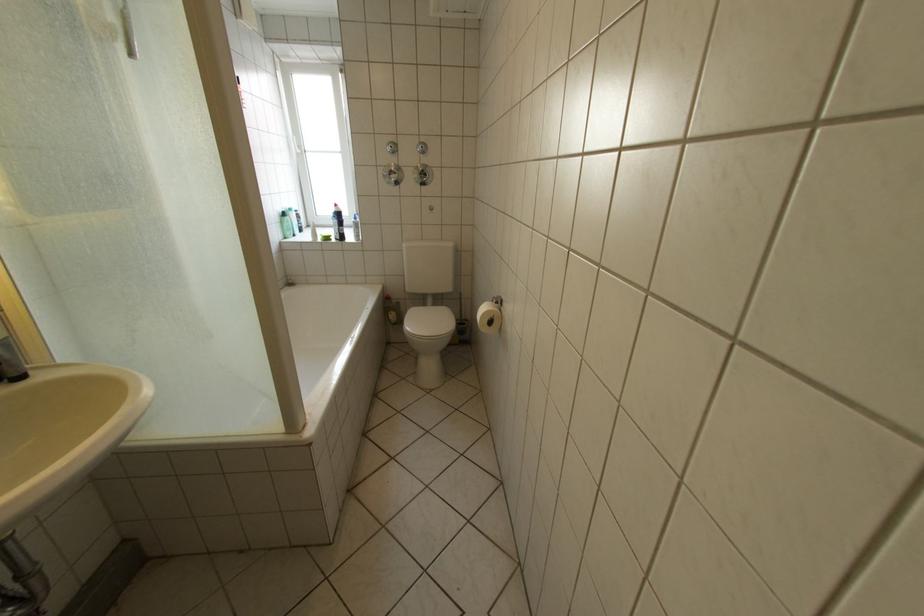
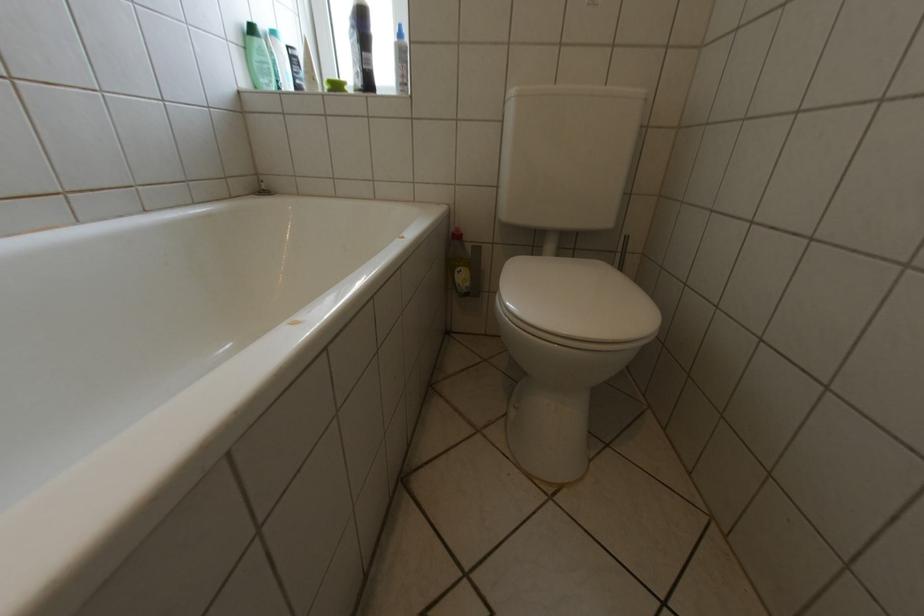
Where in the second image is the point corresponding to the point at 298,225 from the first image?

(268, 59)